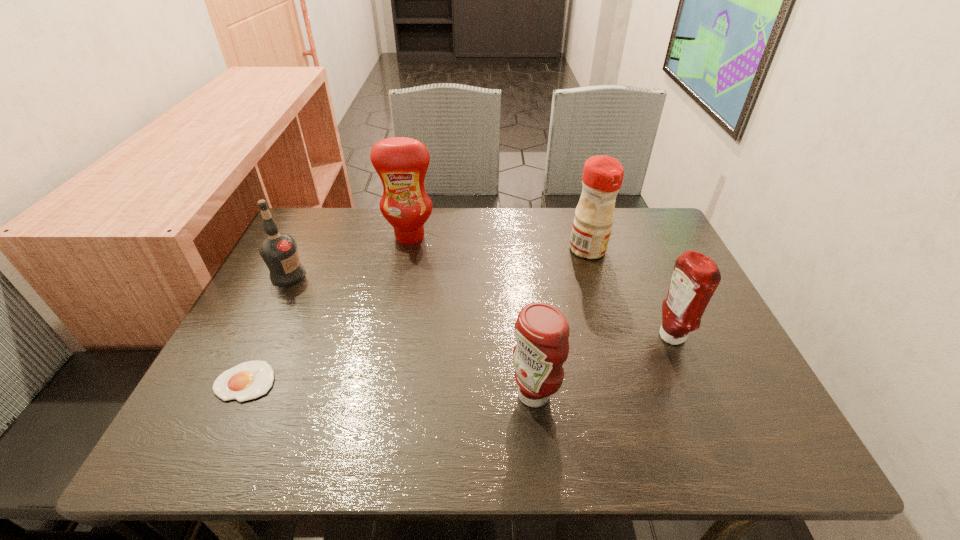
At what (x,y) coordinates should I click in order to perform the action: click on the third object from left to right. Please return your answer as a coordinate pair (x, y). This screenshot has height=540, width=960. Looking at the image, I should click on (401, 163).

The width and height of the screenshot is (960, 540). Identify the location of the second condiment from right to left. (602, 177).

Identify the location of vodka. This screenshot has height=540, width=960. (279, 251).

Find the location of `the third nearest object`. the third nearest object is located at coordinates (695, 277).

Where is `the second nearest condiment`? Image resolution: width=960 pixels, height=540 pixels. the second nearest condiment is located at coordinates (695, 277).

Where is `the second condiment from left to right`? the second condiment from left to right is located at coordinates (541, 331).

Where is `the third object from right to left`? the third object from right to left is located at coordinates (541, 331).

Where is `egg yolk`? egg yolk is located at coordinates (249, 380).

Where is `vacant area located on the label side of the leftmost condiment`? Image resolution: width=960 pixels, height=540 pixels. vacant area located on the label side of the leftmost condiment is located at coordinates (390, 336).

Image resolution: width=960 pixels, height=540 pixels. I want to click on vacant position located on the front of the third condiment from left to right, so click(605, 304).